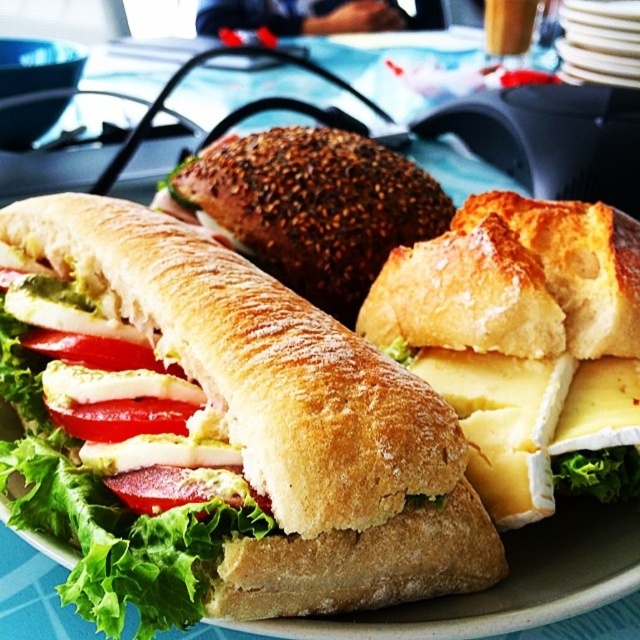
Question: Does breadsoftsandwich at center have a lesser width compared to yellow creamy cheese at center?

Choices:
 (A) no
 (B) yes

Answer: (A)

Question: Does yellow creamy cheese at center appear over yellow creamy cheese at lower right?

Choices:
 (A) yes
 (B) no

Answer: (A)

Question: Which point is farther from the camera taking this photo?

Choices:
 (A) (273, 602)
 (B) (516, 506)

Answer: (B)

Question: Estimate the real-world distances between objects in this image. Which object is closer to the breadsoftsandwich at center?

Choices:
 (A) red glossy tomato at center
 (B) white ceramic plate at upper right
 (C) yellow creamy cheese at center

Answer: (A)

Question: Which point is farther from the camera taking this photo?

Choices:
 (A) (227, 502)
 (B) (592, 54)

Answer: (B)

Question: Can you confirm if breadsoftsandwich at center is bigger than red glossy tomato at center?

Choices:
 (A) no
 (B) yes

Answer: (B)